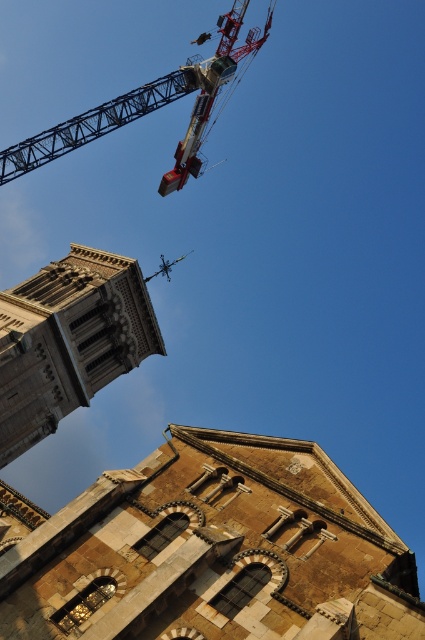
In the scene shown: You are an architect assessing the visual impact of the metallic gray crane at upper center on the historic brown stone tower at center. Which structure has a smaller width when viewed from the front?

The brown stone tower at center is thinner than the metallic gray crane at upper center, so the brown stone tower at center has a smaller width when viewed from the front.